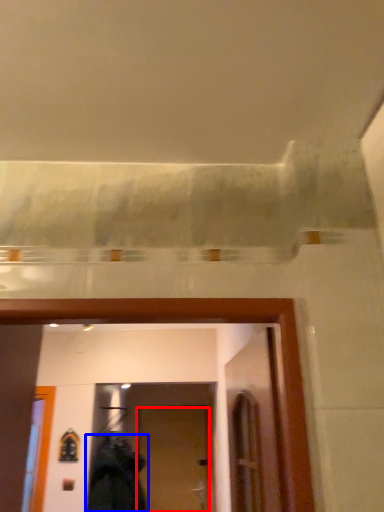
Question: Among these objects, which one is farthest to the camera, door (highlighted by a red box) or clothing (highlighted by a blue box)?

Choices:
 (A) door
 (B) clothing

Answer: (A)